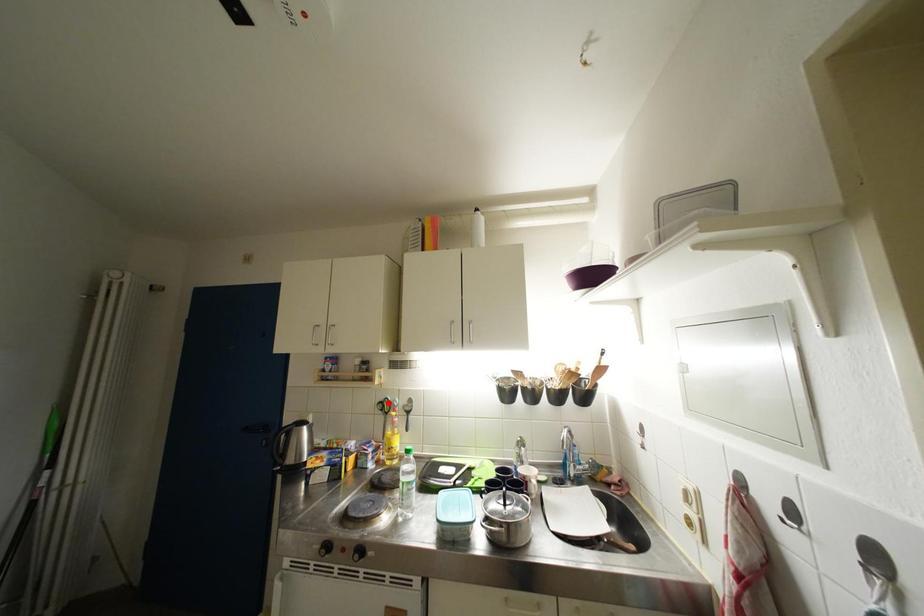
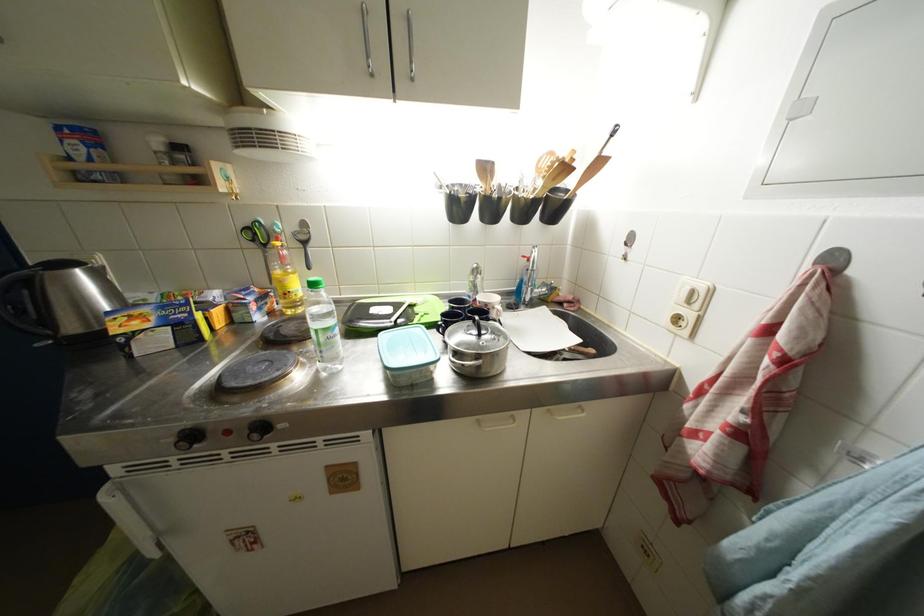
Find the pixel in the second image that matches the highlighted location in the first image.

(253, 227)